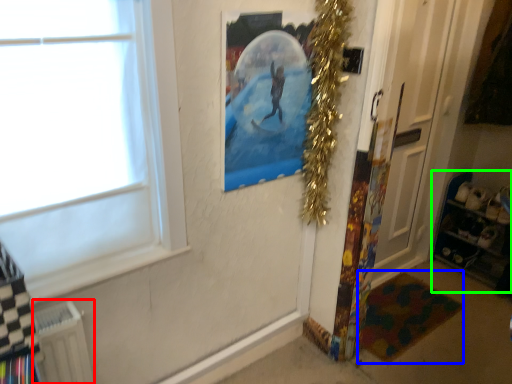
Question: Considering the real-world distances, which object is closest to radiator (highlighted by a red box)? mat (highlighted by a blue box) or shelf (highlighted by a green box).

Choices:
 (A) mat
 (B) shelf

Answer: (A)